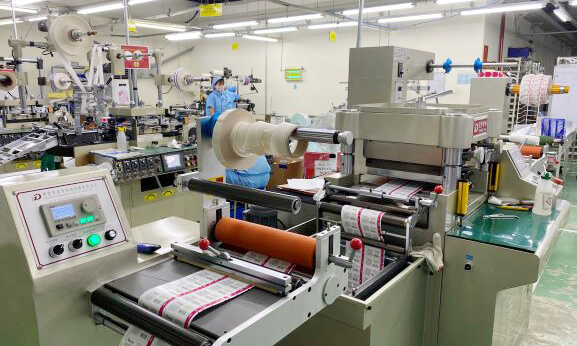
Locate an element on the screen. The image size is (577, 346). floor is located at coordinates (560, 316).